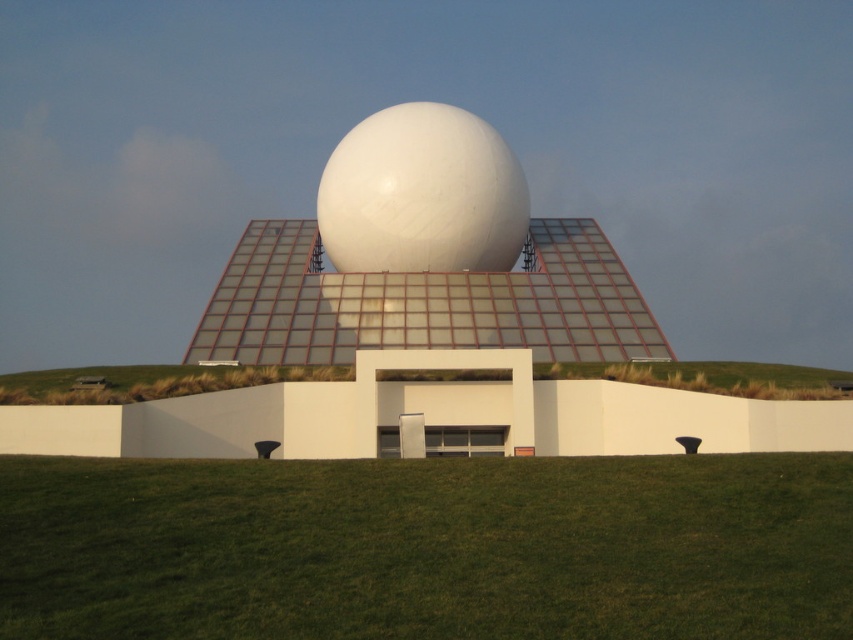
Question: From the image, what is the correct spatial relationship of white glossy sphere at center in relation to green grass at lower center?

Choices:
 (A) left
 (B) right

Answer: (A)

Question: Can you confirm if green grass at center is wider than white glossy sphere at center?

Choices:
 (A) no
 (B) yes

Answer: (B)

Question: Can you confirm if white glossy sphere at center is bigger than green grass at lower center?

Choices:
 (A) yes
 (B) no

Answer: (A)

Question: Among these points, which one is farthest from the camera?

Choices:
 (A) (722, 628)
 (B) (296, 369)
 (C) (459, 156)

Answer: (C)

Question: Which object is closer to the camera taking this photo?

Choices:
 (A) green grass at center
 (B) green grass at lower center

Answer: (A)

Question: Which point is closer to the camera?

Choices:
 (A) (662, 620)
 (B) (410, 246)

Answer: (A)